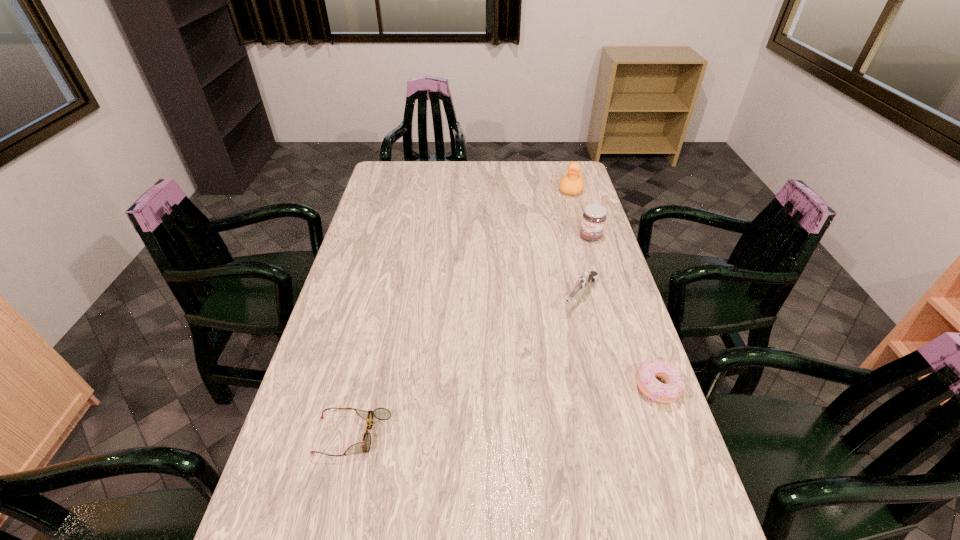
Where is `object that is at the left edge`? This screenshot has width=960, height=540. object that is at the left edge is located at coordinates (380, 413).

Locate an element on the screen. The width and height of the screenshot is (960, 540). doughnut that is at the right edge is located at coordinates (648, 370).

You are a GUI agent. You are given a task and a screenshot of the screen. Output one action in this format:
    pyautogui.click(x=<x>, y=<y>)
    Task: Click on the gun present at the right edge
    Image resolution: width=960 pixels, height=540 pixels.
    Given the screenshot: What is the action you would take?
    pyautogui.click(x=585, y=279)

Identify the location of duck that is at the right edge. The image size is (960, 540). (572, 183).

This screenshot has height=540, width=960. I want to click on jam positioned at the right edge, so click(594, 216).

Where is `object that is at the far right corner`? Image resolution: width=960 pixels, height=540 pixels. object that is at the far right corner is located at coordinates (572, 183).

Where is `free space at the far edge of the desktop`? This screenshot has width=960, height=540. free space at the far edge of the desktop is located at coordinates tap(461, 178).

In the image, there is a desktop. At what (x,y) coordinates should I click in order to perform the action: click on vacant space at the left edge. Please return your answer as a coordinate pair (x, y). Looking at the image, I should click on (378, 272).

Image resolution: width=960 pixels, height=540 pixels. Find the location of `free space at the right edge of the desktop`. free space at the right edge of the desktop is located at coordinates (628, 447).

The image size is (960, 540). Identify the location of free space at the far left corner of the desktop. (382, 179).